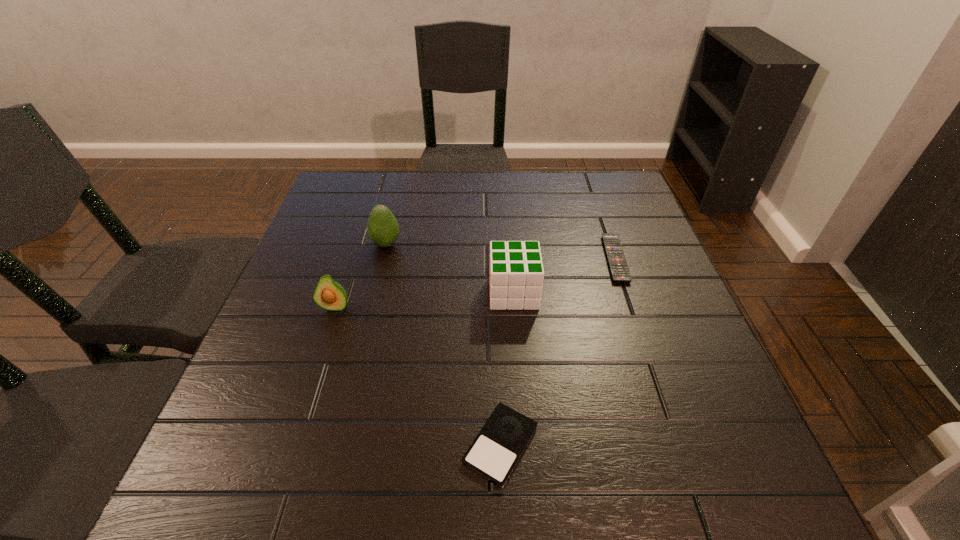
Choose which object is the third nearest neighbor to the leftmost object. Please provide its 2D coordinates. Your answer should be formatted as a tuple, i.e. [(x, y)], where the tuple contains the x and y coordinates of a point satisfying the conditions above.

[(494, 453)]

Image resolution: width=960 pixels, height=540 pixels. I want to click on the third closest object to the cube, so click(x=382, y=227).

I want to click on free spot that satisfies the following two spatial constraints: 1. on the red face of the cube; 2. on the cut side of the leftmost object, so click(x=515, y=307).

You are a GUI agent. You are given a task and a screenshot of the screen. Output one action in this format:
    pyautogui.click(x=<x>, y=<y>)
    Task: Click on the free location that satisfies the following two spatial constraints: 1. on the red face of the cube; 2. on the cut side of the leftmost object
    The height and width of the screenshot is (540, 960).
    Given the screenshot: What is the action you would take?
    pyautogui.click(x=515, y=307)

Where is `free point that satisfies the following two spatial constraints: 1. on the red face of the cube; 2. on the cut side of the nearer avocado`? This screenshot has height=540, width=960. free point that satisfies the following two spatial constraints: 1. on the red face of the cube; 2. on the cut side of the nearer avocado is located at coordinates (515, 307).

Find the location of `free space that satisfies the following two spatial constraints: 1. on the cut side of the iPod; 2. on the right side of the nearer avocado`. free space that satisfies the following two spatial constraints: 1. on the cut side of the iPod; 2. on the right side of the nearer avocado is located at coordinates (290, 444).

The width and height of the screenshot is (960, 540). Find the location of `vacant position in the image that satisfies the following two spatial constraints: 1. on the red face of the cube; 2. on the cut side of the leftmost object`. vacant position in the image that satisfies the following two spatial constraints: 1. on the red face of the cube; 2. on the cut side of the leftmost object is located at coordinates (515, 307).